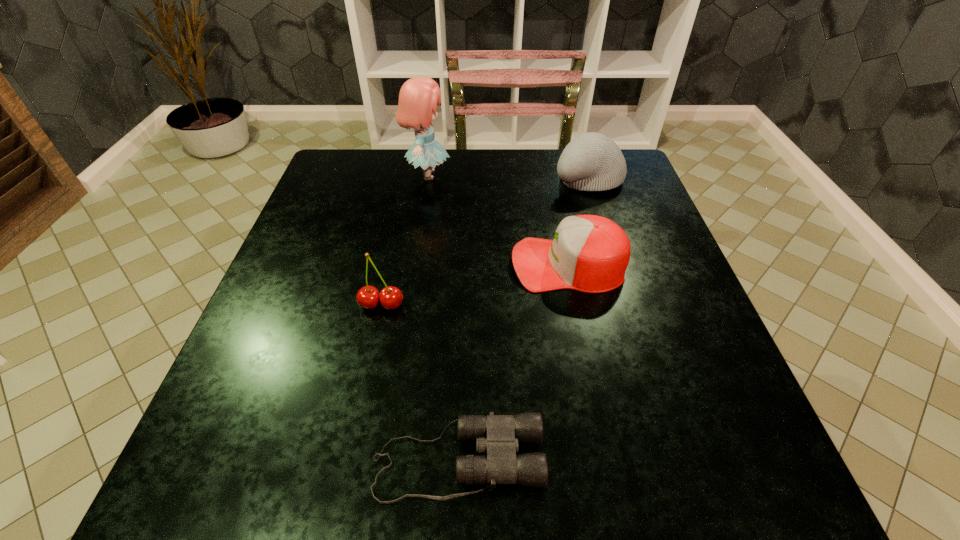
Where is `doll`? This screenshot has width=960, height=540. doll is located at coordinates (418, 97).

Locate an element on the screen. beanie is located at coordinates (592, 161).

Image resolution: width=960 pixels, height=540 pixels. In order to click on cherry in this screenshot , I will do `click(368, 297)`.

Locate an element on the screen. This screenshot has width=960, height=540. baseball cap is located at coordinates (589, 253).

At what (x,y) coordinates should I click in order to perform the action: click on the shortest object. Please return your answer as a coordinate pair (x, y). Looking at the image, I should click on point(498,435).

This screenshot has width=960, height=540. In order to click on binoculars in this screenshot , I will do `click(498, 435)`.

Locate an element on the screen. This screenshot has width=960, height=540. vacant space positioned on the front-facing side of the tallest object is located at coordinates (516, 175).

Where is `free space located 0.370m on the front of the beanie`? This screenshot has width=960, height=540. free space located 0.370m on the front of the beanie is located at coordinates tap(628, 306).

I want to click on free region located with the stems of the cherry pointing upwards, so click(x=350, y=452).

Identify the location of vacant area situated 0.360m on the front-facing side of the third nearest object. (345, 264).